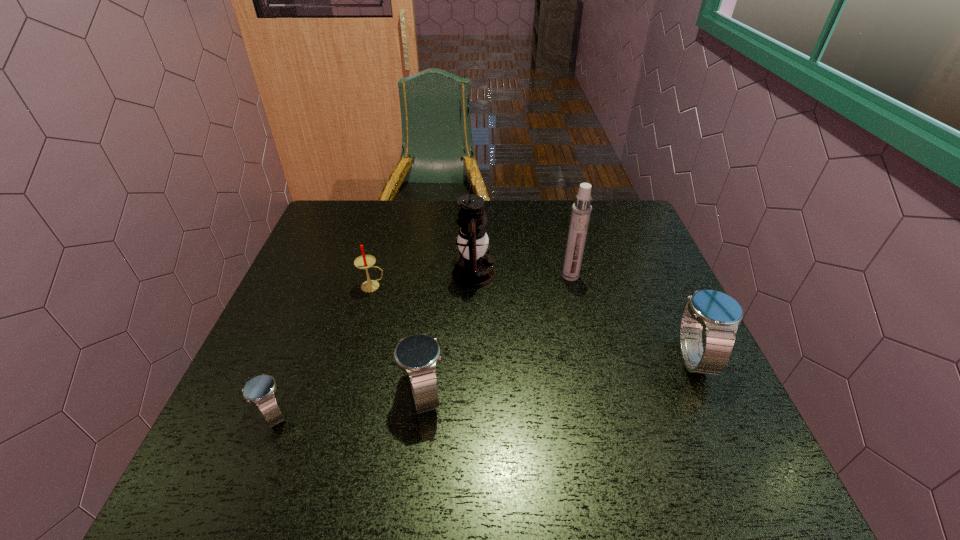
Where is `the shortest object`? The height and width of the screenshot is (540, 960). the shortest object is located at coordinates (260, 390).

You are a GUI agent. You are given a task and a screenshot of the screen. Output one action in this format:
    pyautogui.click(x=<x>, y=<y>)
    Task: Click on the leftmost object
    The height and width of the screenshot is (540, 960).
    Given the screenshot: What is the action you would take?
    pyautogui.click(x=260, y=390)

Find the location of a particular element. the second shortest watch is located at coordinates (417, 355).

This screenshot has width=960, height=540. What are the coordinates of `the rightmost watch` in the screenshot? It's located at (719, 314).

In order to click on aerosol can in this screenshot , I will do `click(581, 210)`.

Find the location of a particular element. Image resolution: width=960 pixels, height=540 pixels. candle is located at coordinates (365, 261).

Find the location of `lantern`. lantern is located at coordinates (473, 268).

Where is `free region located 0.260m on the right of the leftmost watch`? free region located 0.260m on the right of the leftmost watch is located at coordinates (421, 414).

I want to click on vacant area situated on the back of the second shortest watch, so click(x=438, y=269).

Locate an element on the screen. Image resolution: width=960 pixels, height=540 pixels. free region located on the left of the rightmost watch is located at coordinates (520, 357).